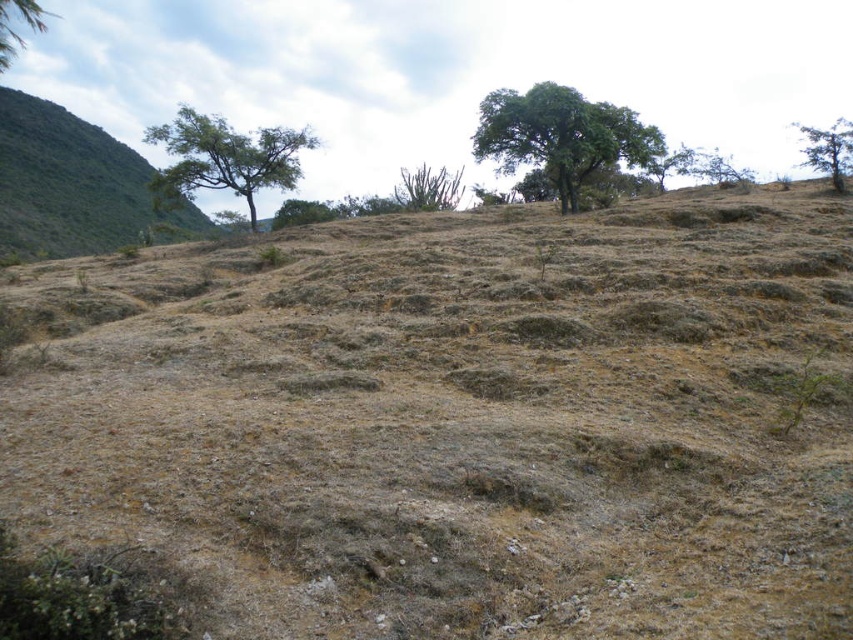
Based on the photo, you are an environmental scientist examining the dry landscape. You observe the dried soil at center and the green leafy tree at upper right. Which object occupies a larger area in the scene?

The green leafy tree at upper right occupies a larger area than the dried soil at center because the dried soil at center has a smaller width compared to the green leafy tree at upper right.

You are an environmental scientist studying the landscape. You observe the dried soil at center and the green leafy tree at upper right. Which object occupies a larger area in the scene?

The green leafy tree at upper right occupies a larger area in the scene compared to the dried soil at center, as the dried soil at center has a smaller size according to the description.

You are an explorer in this dry landscape and need to decide which area to prioritize for finding water. Based on the scene, which object would you consider first, the green leafy hillside at left or the green leafy tree at upper right?

The green leafy hillside at left has a lesser width compared to the green leafy tree at upper right. Since the tree is wider, it might indicate more vegetation and thus a better chance of finding water.